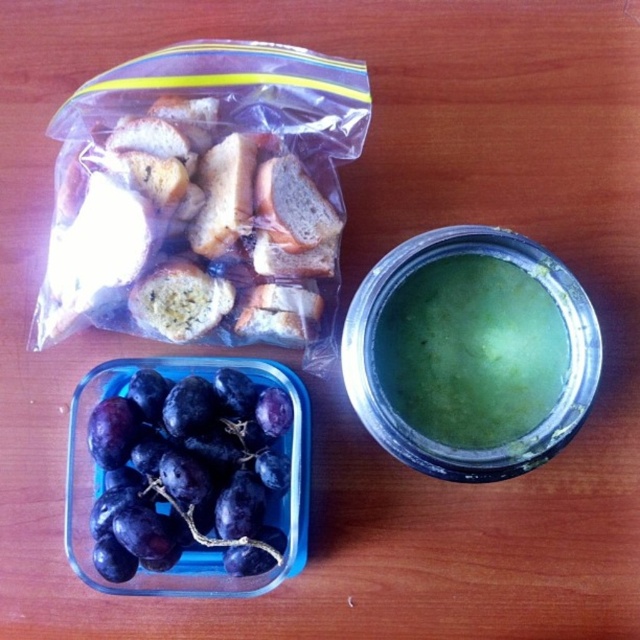
Question: In this image, where is purple matte grapes at lower left located relative to green matte soup at upper right?

Choices:
 (A) above
 (B) below

Answer: (B)

Question: Is purple matte grapes at lower left wider than green matte soup at upper right?

Choices:
 (A) yes
 (B) no

Answer: (A)

Question: Among these objects, which one is nearest to the camera?

Choices:
 (A) purple matte grapes at lower left
 (B) green matte soup at upper right

Answer: (A)

Question: In this image, where is purple matte grapes at lower left located relative to green matte soup at upper right?

Choices:
 (A) below
 (B) above

Answer: (A)

Question: Which point is closer to the camera?

Choices:
 (A) purple matte grapes at lower left
 (B) green matte soup at upper right

Answer: (A)